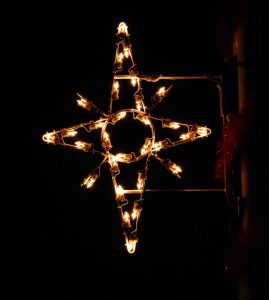
Where is `light`? Image resolution: width=269 pixels, height=300 pixels. light is located at coordinates (130, 245), (196, 77).